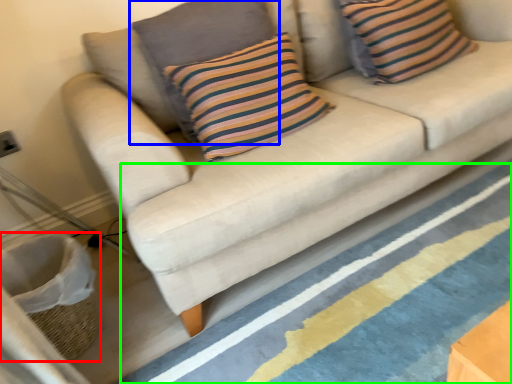
Question: Estimate the real-world distances between objects in this image. Which object is closer to basket (highlighted by a red box), pillow (highlighted by a blue box) or stripe (highlighted by a green box)?

Choices:
 (A) pillow
 (B) stripe

Answer: (B)